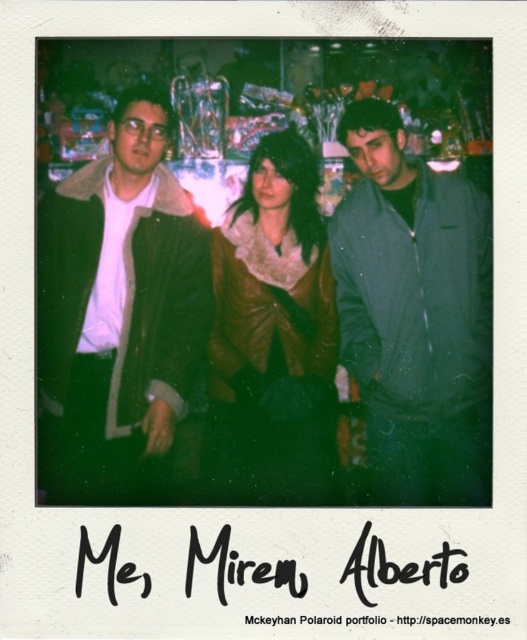
Question: Which point is closer to the camera?

Choices:
 (A) matte green jacket at center
 (B) matte brown jacket at left

Answer: (A)

Question: Which point is closer to the camera?

Choices:
 (A) (461, 387)
 (B) (108, 330)

Answer: (A)

Question: Which object appears closest to the camera in this image?

Choices:
 (A) matte green jacket at center
 (B) matte brown jacket at left

Answer: (A)

Question: In this image, where is matte green jacket at center located relative to brown leather jacket at center?

Choices:
 (A) above
 (B) below

Answer: (A)

Question: Is matte brown jacket at left positioned in front of brown leather jacket at center?

Choices:
 (A) yes
 (B) no

Answer: (A)

Question: Is the position of matte brown jacket at left more distant than that of matte green jacket at center?

Choices:
 (A) yes
 (B) no

Answer: (A)